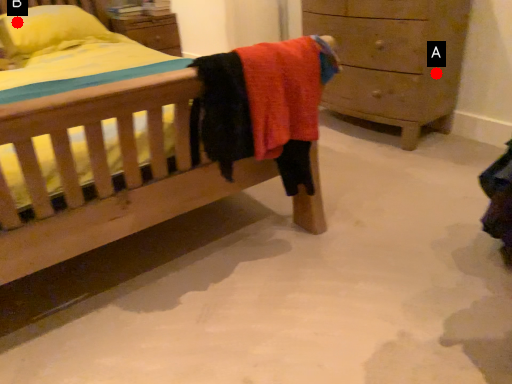
Question: Two points are circled on the image, labeled by A and B beside each circle. Which point is farther to the camera?

Choices:
 (A) A is further
 (B) B is further

Answer: (B)